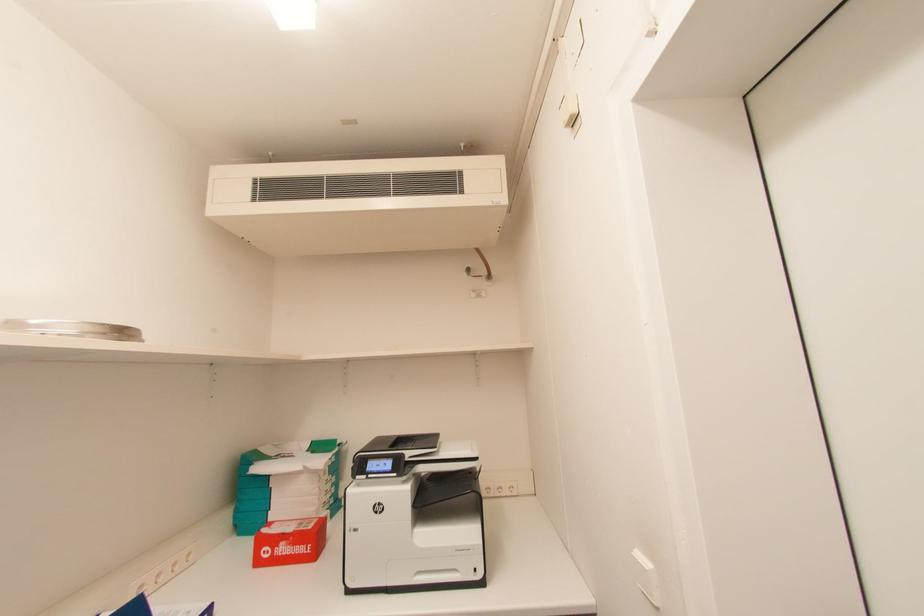
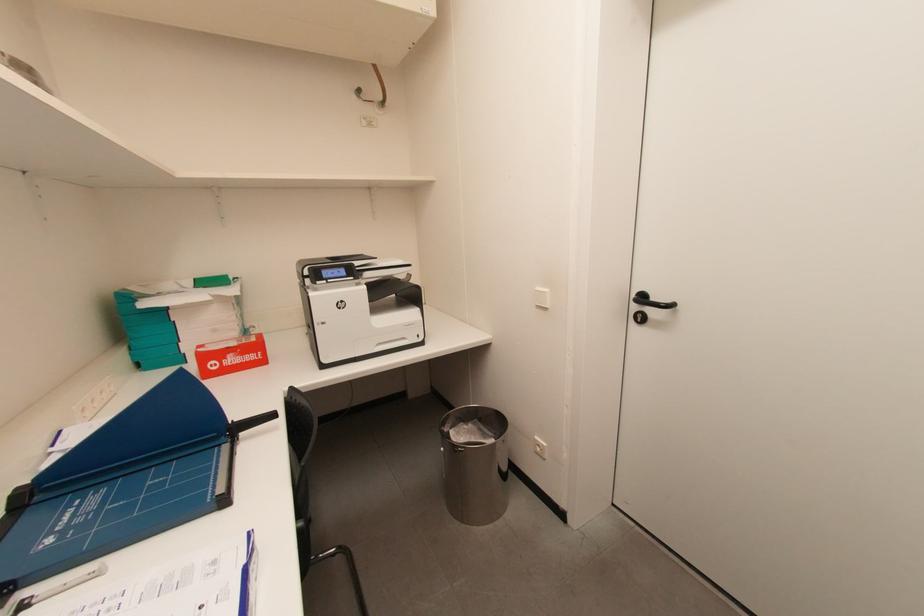
In the scene shown: The first image is from the beginning of the video and the second image is from the end. How did the camera likely rotate when shooting the video?

The rotation direction of the camera is right-down.